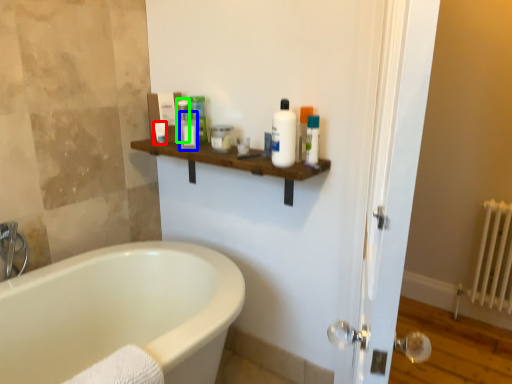
Question: Which object is positioned closest to toiletry (highlighted by a red box)? Select from toiletry (highlighted by a blue box) and toiletry (highlighted by a green box).

Choices:
 (A) toiletry
 (B) toiletry

Answer: (B)